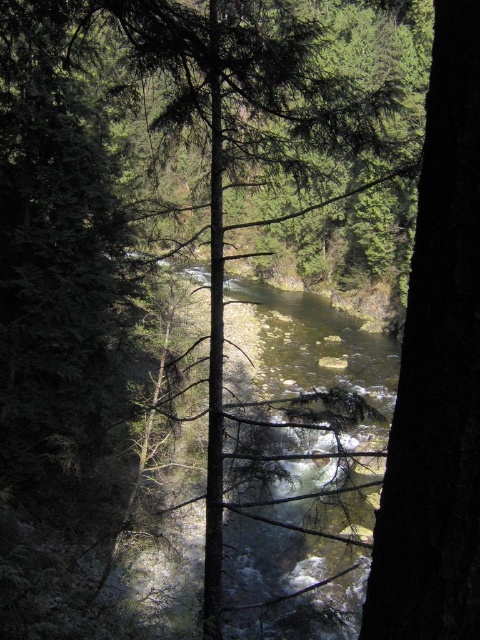
Question: Does translucent water at center have a larger size compared to dark brown bark tree at right?

Choices:
 (A) yes
 (B) no

Answer: (A)

Question: Does translucent water at center lie in front of dark brown bark tree at right?

Choices:
 (A) yes
 (B) no

Answer: (B)

Question: Which of the following is the farthest from the observer?

Choices:
 (A) (434, 28)
 (B) (317, 464)

Answer: (B)

Question: Does translucent water at center have a larger size compared to dark brown bark tree at right?

Choices:
 (A) no
 (B) yes

Answer: (B)

Question: Which of the following is the farthest from the observer?

Choices:
 (A) dark brown bark tree at right
 (B) translucent water at center

Answer: (B)